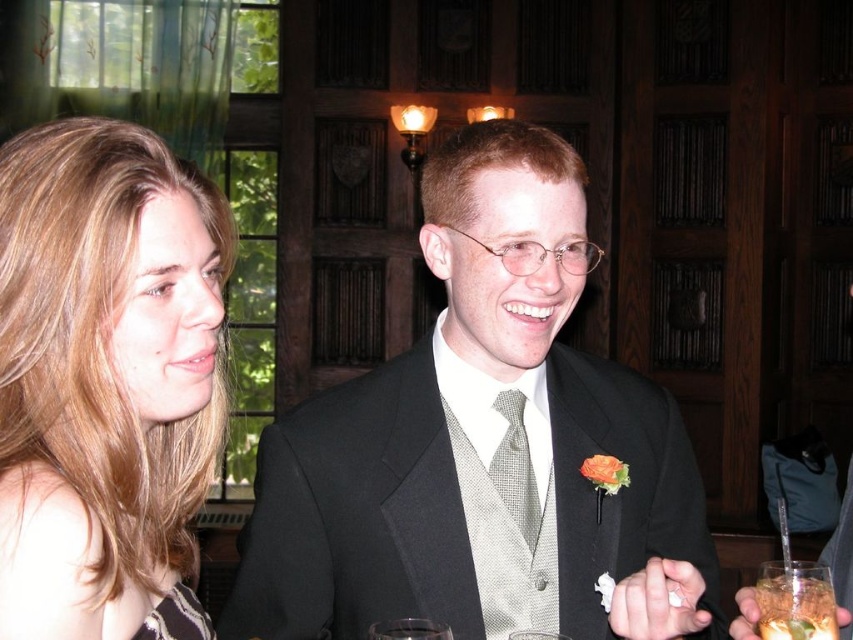
Can you confirm if blonde hair at left is wider than black textured dress at lower left?

Correct, the width of blonde hair at left exceeds that of black textured dress at lower left.

Identify the location of blonde hair at left. This screenshot has height=640, width=853. (103, 372).

Which of these two, matte black suit at center or black textured dress at lower left, stands taller?

Standing taller between the two is matte black suit at center.

Is point (495, 202) positioned after point (190, 616)?

Yes, point (495, 202) is farther from viewer.

Find the location of a particular element. This screenshot has height=640, width=853. matte black suit at center is located at coordinates (480, 442).

Is matte black suit at center to the left of blonde hair at left from the viewer's perspective?

In fact, matte black suit at center is to the right of blonde hair at left.

Does matte black suit at center lie behind blonde hair at left?

Yes.

Where is `matte black suit at center`? Image resolution: width=853 pixels, height=640 pixels. matte black suit at center is located at coordinates (480, 442).

Locate an element on the screen. matte black suit at center is located at coordinates (480, 442).